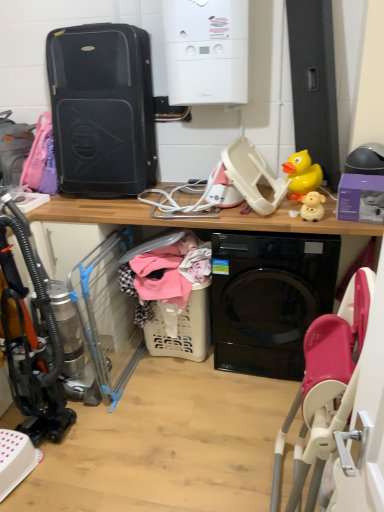
Question: Considering the positions of point (317, 219) and point (216, 365), is point (317, 219) closer or farther from the camera than point (216, 365)?

Choices:
 (A) farther
 (B) closer

Answer: (B)

Question: Do you think white matte sheep at upper right, placed as the second toy when sorted from top to bottom, is within black glossy washing machine at center, or outside of it?

Choices:
 (A) outside
 (B) inside

Answer: (A)

Question: Considering the real-world distances, which object is farthest from the white matte sheep at upper right, the second toy in the back-to-front sequence?

Choices:
 (A) black hard shell suitcase at upper left
 (B) white matte boiler at upper center
 (C) black glossy washing machine at center
 (D) yellow rubber duck at upper right, the first toy viewed from the top

Answer: (A)

Question: Which is farther from the black glossy washing machine at center?

Choices:
 (A) white matte sheep at upper right, placed as the second toy when sorted from top to bottom
 (B) white matte boiler at upper center
 (C) yellow rubber duck at upper right, the 2th toy ordered from the bottom
 (D) black hard shell suitcase at upper left

Answer: (B)